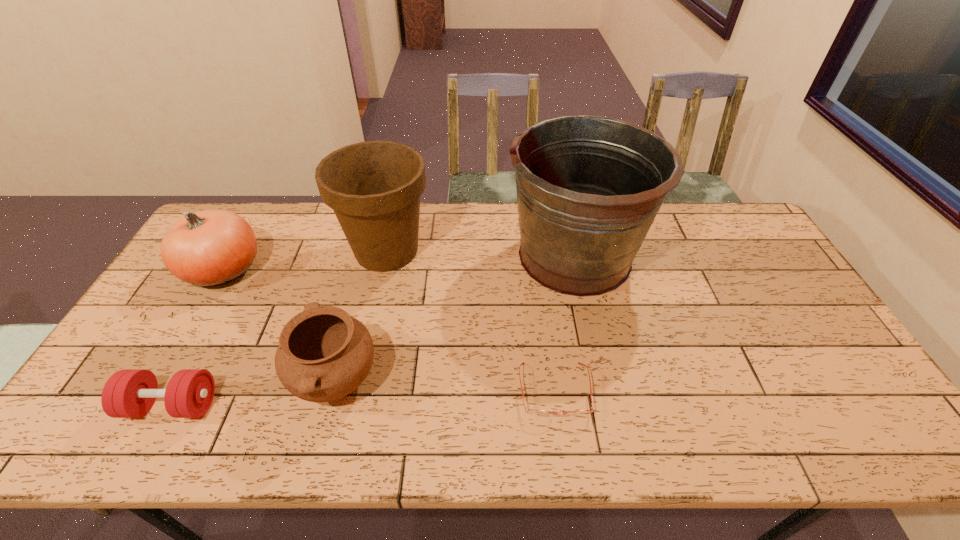
The image size is (960, 540). In order to click on the tallest object in this screenshot , I will do `click(588, 188)`.

Find the location of a particular element. Image resolution: width=960 pixels, height=540 pixels. the fifth shortest object is located at coordinates (374, 187).

The width and height of the screenshot is (960, 540). I want to click on pumpkin, so click(x=207, y=248).

At what (x,y) coordinates should I click in order to perform the action: click on pottery. Please return your answer as a coordinate pair (x, y). Image resolution: width=960 pixels, height=540 pixels. Looking at the image, I should click on (324, 354).

This screenshot has width=960, height=540. I want to click on the fifth tallest object, so click(130, 393).

The width and height of the screenshot is (960, 540). Identify the location of spectacles. (536, 413).

Locate an element on the screen. free space located on the right of the tallest object is located at coordinates pyautogui.click(x=722, y=256).

This screenshot has height=540, width=960. In order to click on vacant space located 0.070m on the front of the fifth shortest object in this screenshot , I will do `click(375, 301)`.

Identify the location of free region located on the right of the pumpkin. (300, 269).

Where is `vacant space situated on the right of the pottery`? The width and height of the screenshot is (960, 540). vacant space situated on the right of the pottery is located at coordinates tap(475, 380).